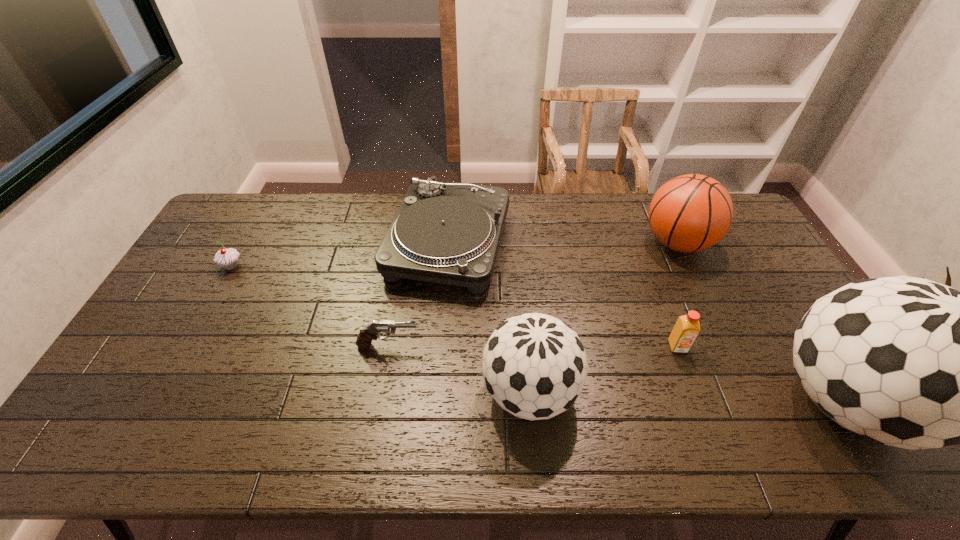
At what (x,y) coordinates should I click in order to perform the action: click on vacant region located 0.100m on the front and back of the orange juice. Please return your answer as a coordinate pair (x, y). This screenshot has height=540, width=960. Looking at the image, I should click on (692, 386).

In order to click on blank area located at the barrel of the pistol in this screenshot , I will do `click(510, 346)`.

You are a GUI agent. You are given a task and a screenshot of the screen. Output one action in this format:
    pyautogui.click(x=<x>, y=<y>)
    Task: Click on the basketball that is at the far edge
    The height and width of the screenshot is (540, 960).
    Given the screenshot: What is the action you would take?
    pyautogui.click(x=690, y=213)

The height and width of the screenshot is (540, 960). Identify the location of record player located at the far edge. (444, 232).

Where is `object that is at the near edge`? Image resolution: width=960 pixels, height=540 pixels. object that is at the near edge is located at coordinates (534, 365).

Where is `object that is at the left edge`? The image size is (960, 540). object that is at the left edge is located at coordinates (227, 258).

Identify the location of object that is at the right edge. This screenshot has width=960, height=540. (690, 213).

You are a GUI agent. You are given a task and a screenshot of the screen. Output one action in this format:
    pyautogui.click(x=<x>, y=<y>)
    Task: Click on the object present at the far right corner
    The height and width of the screenshot is (540, 960).
    Given the screenshot: What is the action you would take?
    pyautogui.click(x=690, y=213)

You are a GUI agent. You are given a task and a screenshot of the screen. Output one action in this format:
    pyautogui.click(x=<x>, y=<y>)
    Task: Click on the free space at the far edge of the desktop
    
    Given the screenshot: What is the action you would take?
    pyautogui.click(x=356, y=226)

Where is `vacant space at the near edge`? The width and height of the screenshot is (960, 540). vacant space at the near edge is located at coordinates (658, 396).